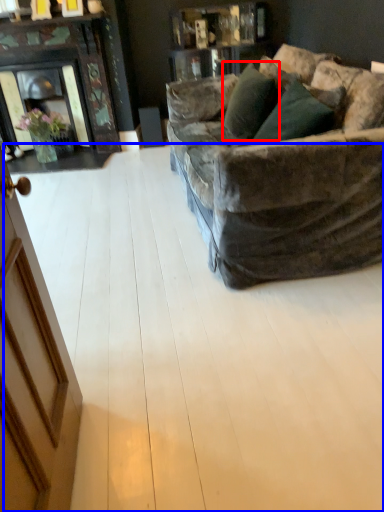
Question: Which point is further to the camera, pillow (highlighted by a red box) or plywood (highlighted by a blue box)?

Choices:
 (A) pillow
 (B) plywood

Answer: (A)